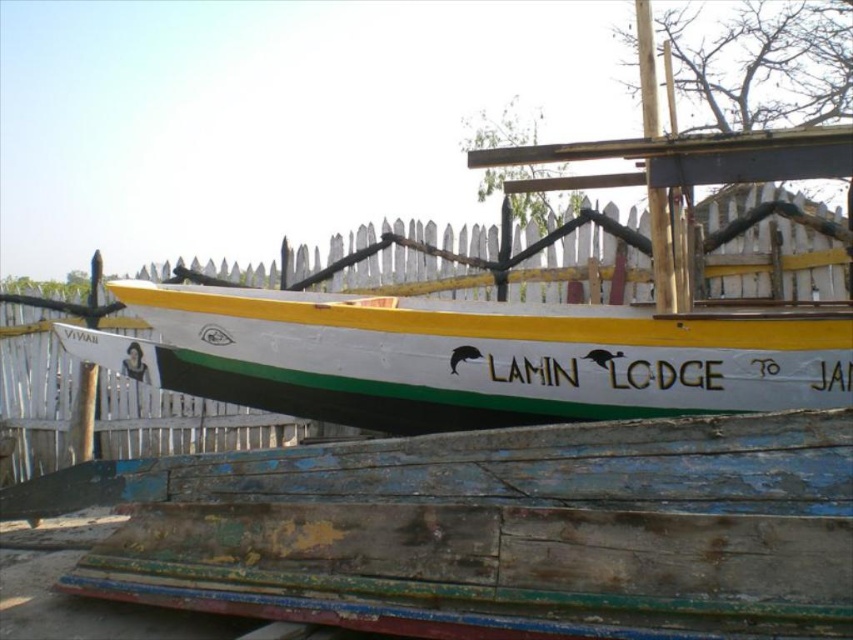
Can you confirm if white painted wood boat at center is positioned above white wooden fence at center?

Yes, white painted wood boat at center is above white wooden fence at center.

Is point (605, 317) closer to camera compared to point (274, 436)?

Yes.

The height and width of the screenshot is (640, 853). Describe the element at coordinates (468, 356) in the screenshot. I see `white painted wood boat at center` at that location.

In order to click on white painted wood boat at center in this screenshot , I will do `click(468, 356)`.